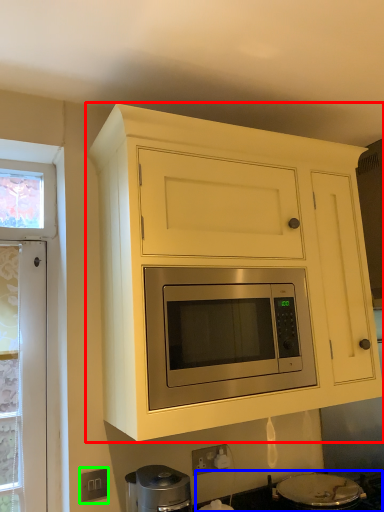
Question: Which object is positioned farthest from cabinetry (highlighted by a red box)? Select from gas stove (highlighted by a blue box) and electric outlet (highlighted by a green box).

Choices:
 (A) gas stove
 (B) electric outlet

Answer: (B)